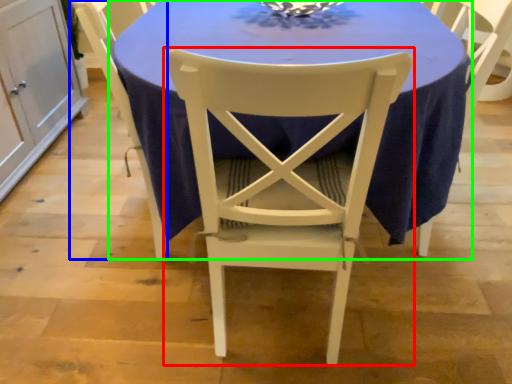
Question: Which object is the closest to the chair (highlighted by a red box)? Choose among these: chair (highlighted by a blue box) or table (highlighted by a green box).

Choices:
 (A) chair
 (B) table

Answer: (B)